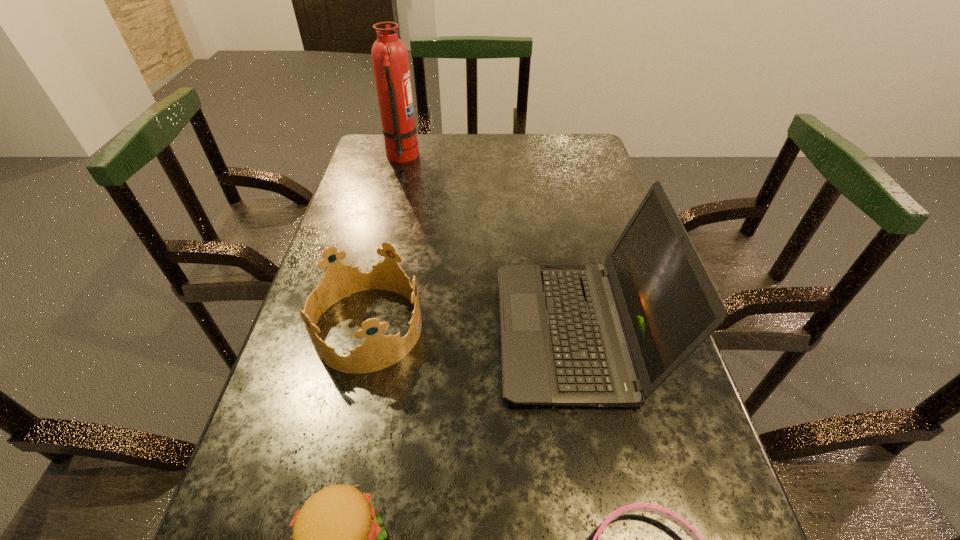
Locate an element on the screen. the tallest object is located at coordinates (389, 55).

I want to click on the farthest object, so click(x=389, y=55).

The height and width of the screenshot is (540, 960). In order to click on laptop_computer in this screenshot , I will do `click(609, 335)`.

Find the location of a particular element. The height and width of the screenshot is (540, 960). tiara is located at coordinates (378, 351).

At what (x,y) coordinates should I click in order to perform the action: click on vacant space situated on the label side of the farthest object. Please return your answer as a coordinate pair (x, y). The width and height of the screenshot is (960, 540). Looking at the image, I should click on (x=526, y=157).

Where is `free location located on the screen of the fourth shortest object`? This screenshot has height=540, width=960. free location located on the screen of the fourth shortest object is located at coordinates (348, 331).

What are the coordinates of `vacant space located 0.370m on the screen of the fourth shortest object` in the screenshot? It's located at (320, 331).

Identify the location of free region located 0.210m on the screen of the fourth shortest object. Image resolution: width=960 pixels, height=540 pixels. (397, 331).

Where is `vacant space located on the front-facing side of the third shortest object`? The image size is (960, 540). vacant space located on the front-facing side of the third shortest object is located at coordinates (582, 328).

In order to click on object that is at the far edge in this screenshot , I will do `click(389, 55)`.